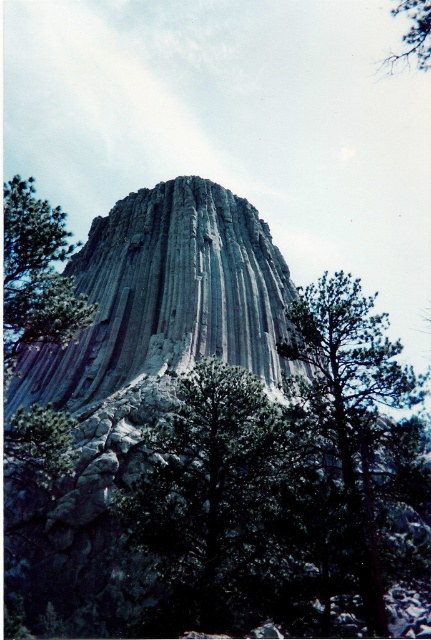
You are standing at the base of the towering rock formation and want to take a photo of the highest point on the rock. The highest point is marked as point (393, 365). If your camera can focus on objects up to 50 meters away, will you be able to capture a clear photo of this point?

The point (393, 365) is 55.82 meters from the camera, which exceeds the camera maximum focus range of 50 meters. Therefore, the camera will not be able to capture a clear photo of this point.

From the picture: You are a hiker standing at the base of the rock formation. You notice the green matte tree at left and the green leafy tree at upper right. Which tree is closer to you?

The green matte tree at left is closer to you because it is positioned under the green leafy tree at upper right, indicating it is in a lower and nearer position.